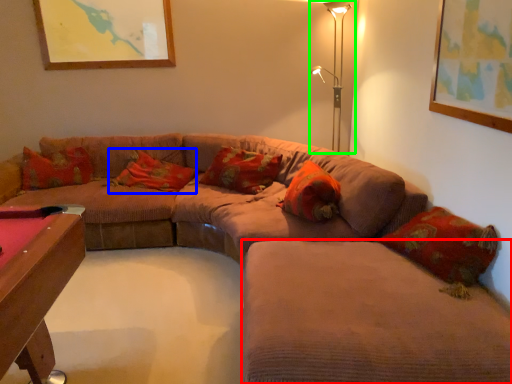
Question: Which object is the closest to the couch (highlighted by a red box)? Choose among these: pillow (highlighted by a blue box) or table lamp (highlighted by a green box).

Choices:
 (A) pillow
 (B) table lamp

Answer: (A)